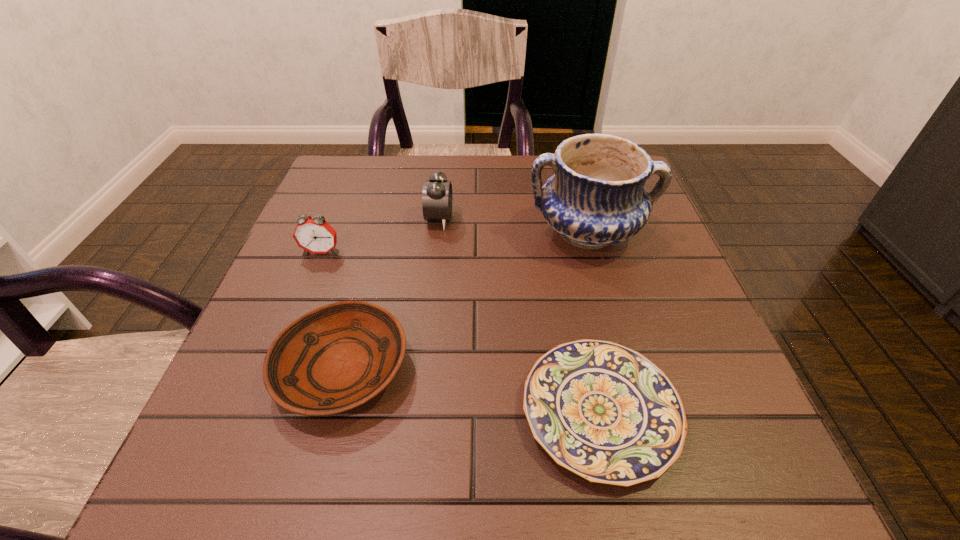
In the image, there is a desktop. Identify the location of blank space at the far edge. (480, 190).

Identify the location of free space at the near edge of the desktop. Image resolution: width=960 pixels, height=540 pixels. (310, 451).

The height and width of the screenshot is (540, 960). In the image, there is a desktop. Find the location of `free space at the left edge`. free space at the left edge is located at coordinates (284, 325).

Locate an element on the screen. This screenshot has height=540, width=960. vacant space at the right edge of the desktop is located at coordinates (610, 269).

In the image, there is a desktop. At what (x,y) coordinates should I click in order to perform the action: click on free region at the near right corner. Please return your answer as a coordinate pair (x, y). Looking at the image, I should click on (773, 453).

Where is `vacant point located between the left plate and the shorter plate`? The height and width of the screenshot is (540, 960). vacant point located between the left plate and the shorter plate is located at coordinates (471, 390).

Identify the location of vacant space that is in between the pottery and the left plate. The height and width of the screenshot is (540, 960). (465, 301).

This screenshot has width=960, height=540. Find the location of `free space between the shorter plate and the pottery`. free space between the shorter plate and the pottery is located at coordinates (594, 322).

You are a GUI agent. You are given a task and a screenshot of the screen. Output one action in this format:
    pyautogui.click(x=<x>, y=<y>)
    Task: Click on the blank region between the pottery and the right alarm clock
    Image resolution: width=960 pixels, height=540 pixels.
    Given the screenshot: What is the action you would take?
    pyautogui.click(x=514, y=226)

Locate an element on the screen. vacant space in between the tallest object and the shorter plate is located at coordinates (594, 322).